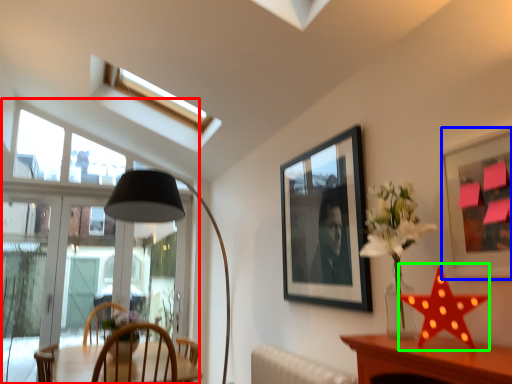
Question: Which object is positioned closest to window (highlighted by a red box)? Select from picture frame (highlighted by a blue box) and star (highlighted by a green box).

Choices:
 (A) picture frame
 (B) star

Answer: (A)